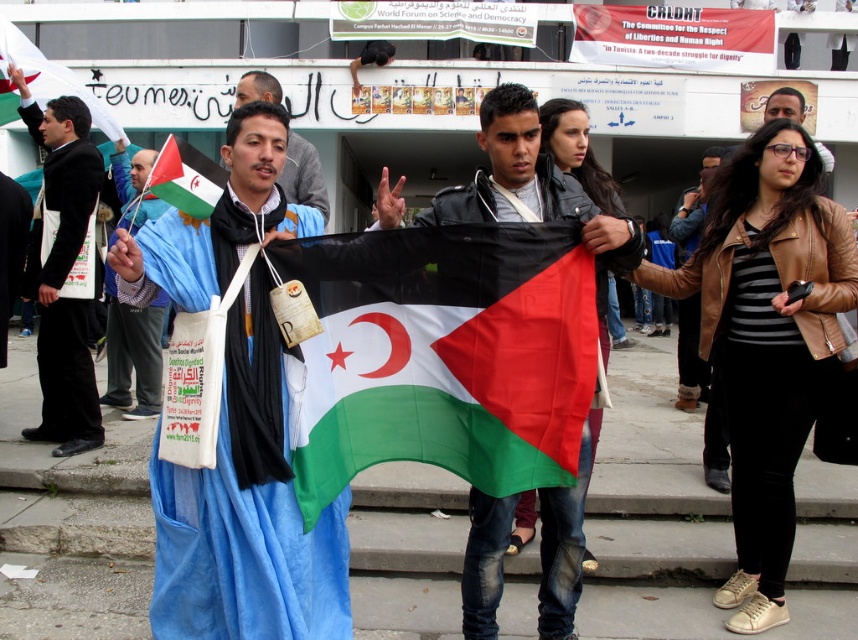
Question: Is black leather jacket at center above blue fabric at center?

Choices:
 (A) yes
 (B) no

Answer: (B)

Question: Is brown leather jacket at right positioned in front of blue fabric at center?

Choices:
 (A) yes
 (B) no

Answer: (B)

Question: Which point is farther to the camera?

Choices:
 (A) (560, 604)
 (B) (185, 164)

Answer: (A)

Question: Does black fabric bag at left have a greater width compared to green fabric flag at center?

Choices:
 (A) yes
 (B) no

Answer: (A)

Question: Which object is the closest to the blue fabric flag at center?

Choices:
 (A) brown leather jacket at right
 (B) black leather jacket at center
 (C) black fabric bag at left

Answer: (C)

Question: Which point is closer to the camera?

Choices:
 (A) black leather jacket at center
 (B) brown leather jacket at right

Answer: (A)